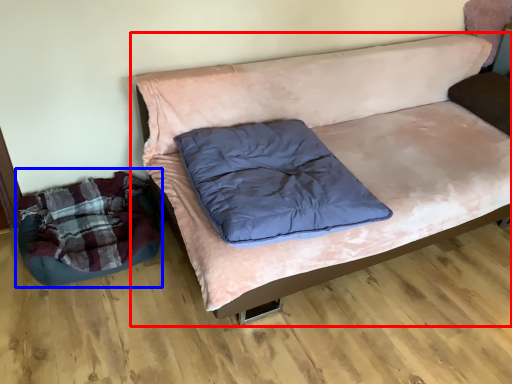
Question: Which object is closer to the camera taking this photo, studio couch (highlighted by a red box) or bean bag chair (highlighted by a blue box)?

Choices:
 (A) studio couch
 (B) bean bag chair

Answer: (A)